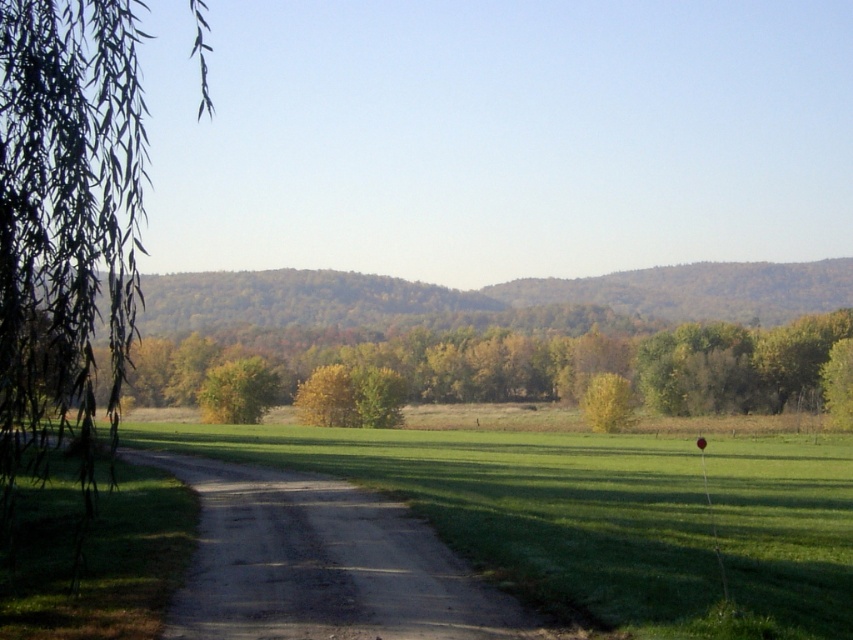
You are standing on the dirt road and want to walk to the green leafy tree at right. Which direction should you walk to avoid the green grass at center?

The green grass at center is positioned under the green leafy tree at right, so to avoid it, you should walk to the right side of the green leafy tree at right.